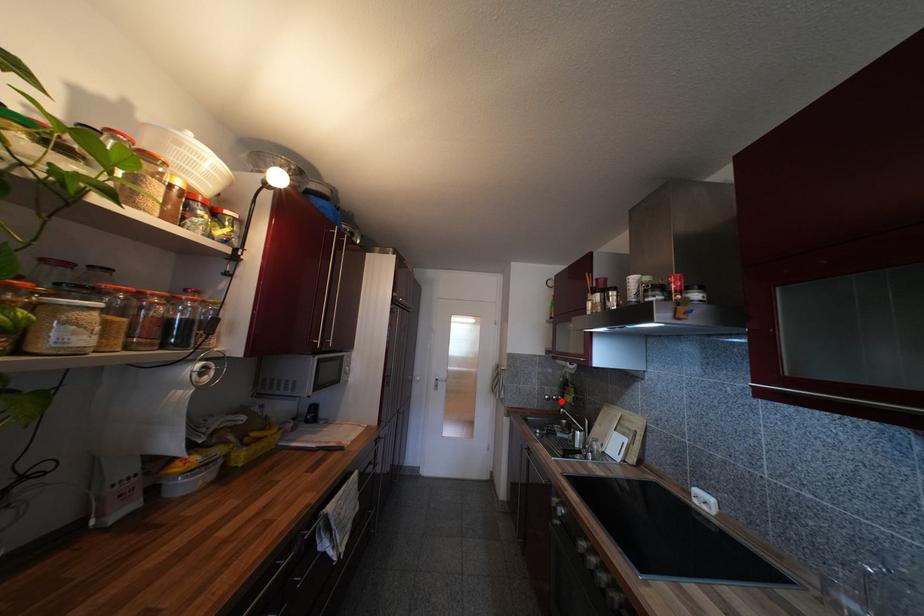
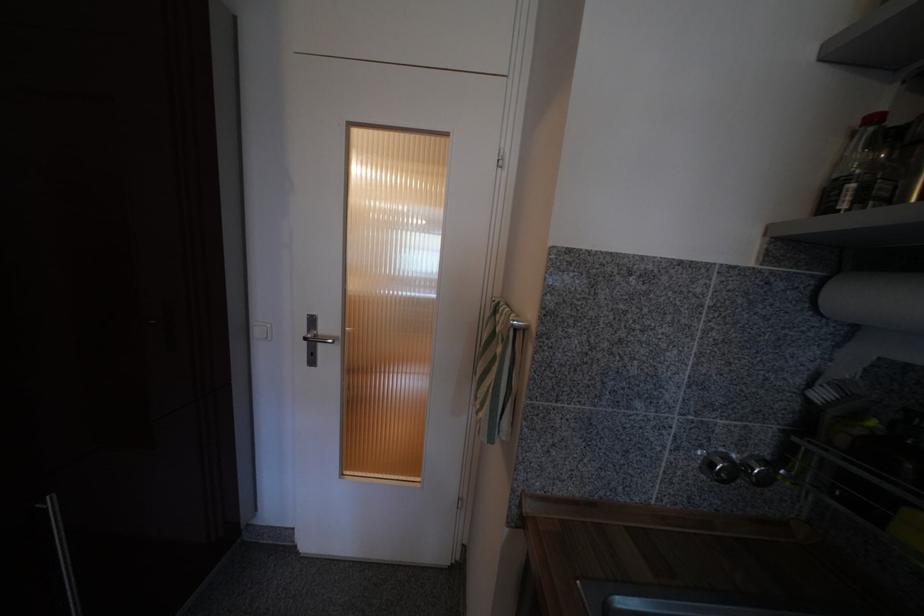
Find the pixel in the second image that matches the highlighted location in the first image.

(772, 482)